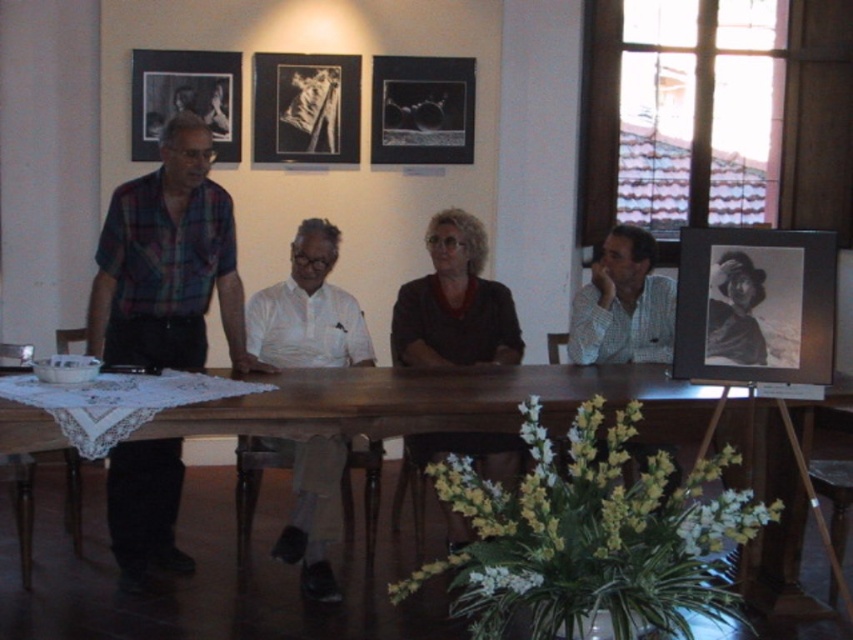
Question: Is wooden table at center to the right of black paper picture frame at right from the viewer's perspective?

Choices:
 (A) yes
 (B) no

Answer: (B)

Question: Among these points, which one is farthest from the camera?

Choices:
 (A) (674, 476)
 (B) (685, 340)

Answer: (A)

Question: Does wooden table at center have a smaller size compared to black paper picture frame at right?

Choices:
 (A) yes
 (B) no

Answer: (B)

Question: Does black paper picture frame at right have a larger size compared to white cotton shirt at center?

Choices:
 (A) yes
 (B) no

Answer: (B)

Question: Which point is closer to the camera taking this photo?

Choices:
 (A) tap(180, 54)
 (B) tap(405, 100)
 (C) tap(645, 358)

Answer: (C)

Question: Which point appears closest to the camera in this image?

Choices:
 (A) (809, 305)
 (B) (183, 72)
 (C) (468, 372)

Answer: (A)